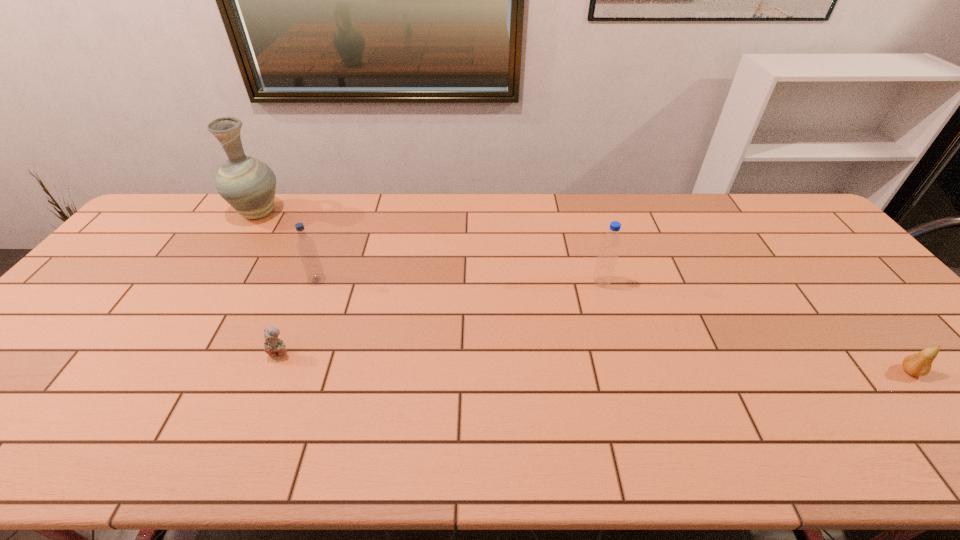
The image size is (960, 540). I want to click on vacant area located 0.210m on the back of the pear, so click(850, 300).

The width and height of the screenshot is (960, 540). Find the location of `object that is at the far edge`. object that is at the far edge is located at coordinates (247, 184).

The width and height of the screenshot is (960, 540). Find the location of `object at the right edge`. object at the right edge is located at coordinates (919, 364).

Locate an element on the screen. Image resolution: width=960 pixels, height=540 pixels. blank space at the far edge is located at coordinates (x=684, y=208).

Find the location of a particular element. This screenshot has height=540, width=960. vacant space at the near edge is located at coordinates (304, 434).

Where is `free space at the left edge of the desktop`? Image resolution: width=960 pixels, height=540 pixels. free space at the left edge of the desktop is located at coordinates (166, 246).

Locate an element on the screen. This screenshot has width=960, height=540. vacant space at the right edge of the desktop is located at coordinates (848, 261).

The height and width of the screenshot is (540, 960). I want to click on free space at the far left corner of the desktop, so click(153, 226).

Where is `vacant space in between the pear and the tallest object`? The width and height of the screenshot is (960, 540). vacant space in between the pear and the tallest object is located at coordinates (585, 292).

This screenshot has height=540, width=960. I want to click on vacant area that lies between the right water bottle and the left water bottle, so click(459, 281).